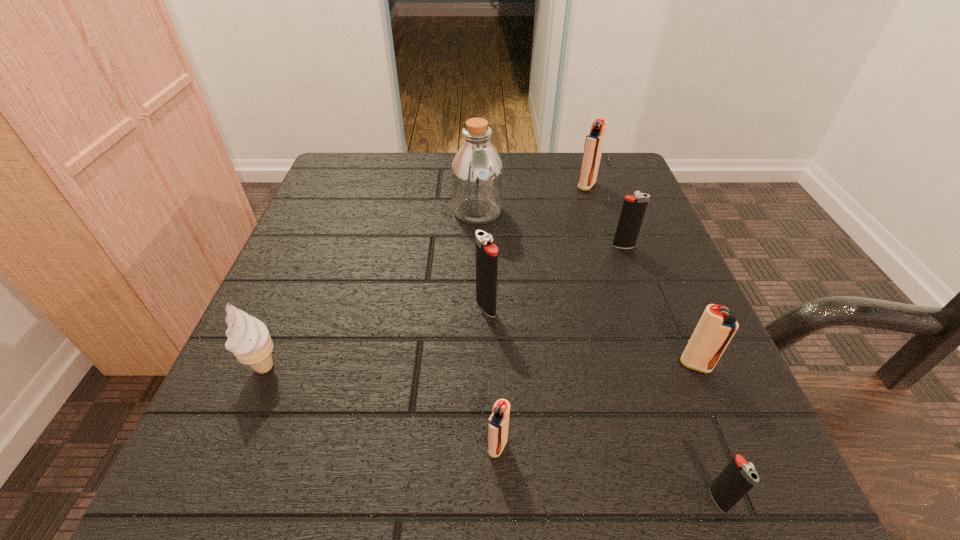
Locate an element on the screen. the closest black igniter relative to the tallest object is located at coordinates [x=486, y=253].

Where is `blank area in the image that satisfies the following two spatial constraints: 1. on the front-facing side of the leftmost object; 2. on the left side of the nearest red igniter`? The width and height of the screenshot is (960, 540). blank area in the image that satisfies the following two spatial constraints: 1. on the front-facing side of the leftmost object; 2. on the left side of the nearest red igniter is located at coordinates (231, 446).

Locate an element on the screen. vacant position in the image that satisfies the following two spatial constraints: 1. on the front side of the second biggest black igniter; 2. on the right side of the tallest object is located at coordinates (477, 246).